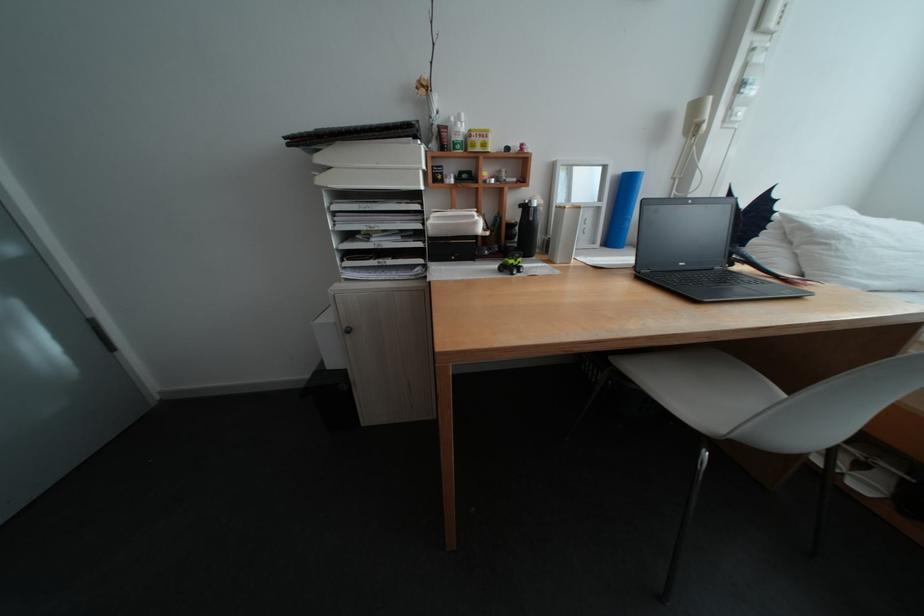
This screenshot has width=924, height=616. In order to click on small cabinet handle in this screenshot , I will do `click(346, 331)`.